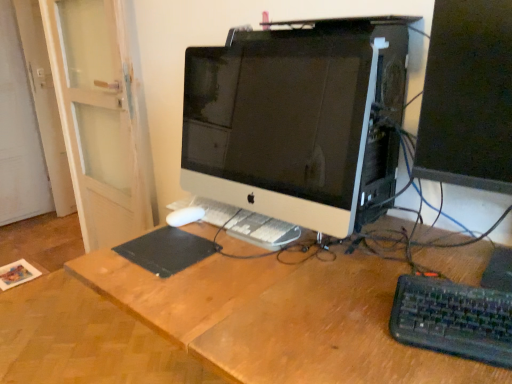
The height and width of the screenshot is (384, 512). What are the coordinates of `vacant point above black matte mousepad at center (from a real-world perspective)` in the screenshot? It's located at (170, 241).